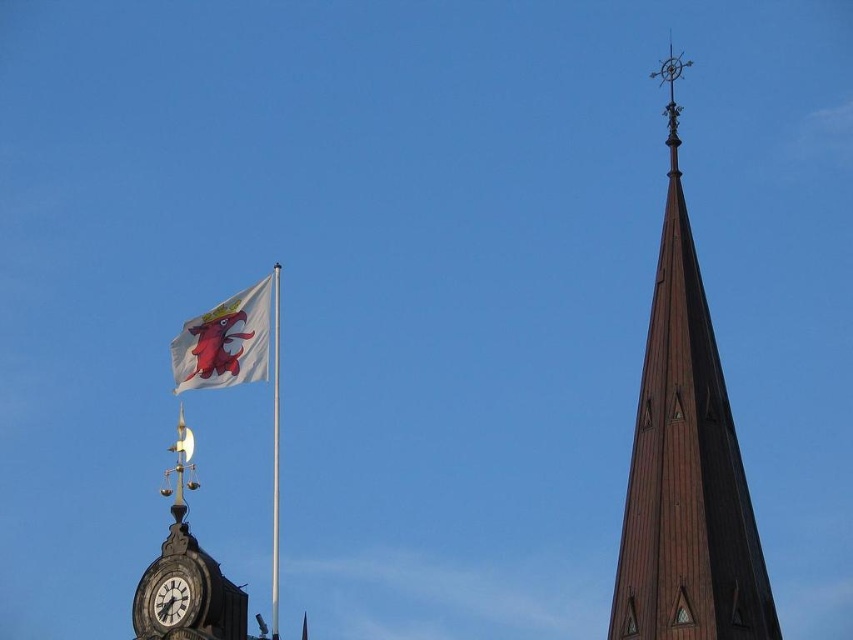
Is point (669, 624) closer to viewer compared to point (247, 349)?

Yes.

Does point (712, 365) come closer to viewer compared to point (183, 378)?

Yes, point (712, 365) is closer to viewer.

The height and width of the screenshot is (640, 853). Identify the location of brown wooden spire at upper right. (685, 461).

Is brown wooden spire at upper right closer to the viewer compared to white fabric flagpole at upper left?

Yes, brown wooden spire at upper right is closer to the viewer.

Does point (743, 512) come farther from viewer compared to point (276, 448)?

No, it is not.

Identify the location of brown wooden spire at upper right. (685, 461).

Can you confirm if matte black clock at lower left is bigger than white clock face at lower left?

Correct, matte black clock at lower left is larger in size than white clock face at lower left.

Does point (184, 554) lie in front of point (158, 602)?

Yes, point (184, 554) is closer to viewer.

The image size is (853, 640). I want to click on matte black clock at lower left, so click(171, 598).